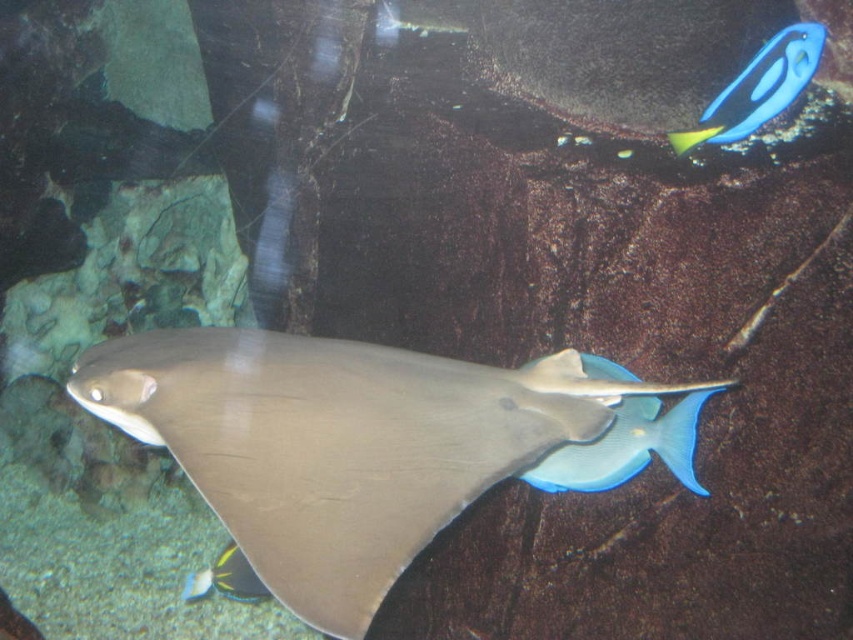
Is smooth gray stingray at center to the left of blue glossy fish at upper right from the viewer's perspective?

Yes, smooth gray stingray at center is to the left of blue glossy fish at upper right.

The width and height of the screenshot is (853, 640). Describe the element at coordinates (340, 444) in the screenshot. I see `smooth gray stingray at center` at that location.

Is point (258, 545) in front of point (743, 81)?

Yes, it is in front of point (743, 81).

The image size is (853, 640). Find the location of `smooth gray stingray at center`. smooth gray stingray at center is located at coordinates (340, 444).

Does smooth gray stingray at center have a larger size compared to shiny blue fish at lower left?

Yes, smooth gray stingray at center is bigger than shiny blue fish at lower left.

Consider the image. Can you confirm if smooth gray stingray at center is taller than shiny blue fish at lower left?

Correct, smooth gray stingray at center is much taller as shiny blue fish at lower left.

Is point (390, 448) less distant than point (196, 582)?

Yes, point (390, 448) is in front of point (196, 582).

This screenshot has width=853, height=640. Find the location of `smooth gray stingray at center`. smooth gray stingray at center is located at coordinates (340, 444).

Does blue glossy fish at center have a smaller size compared to shiny blue fish at lower left?

Correct, blue glossy fish at center occupies less space than shiny blue fish at lower left.

Looking at this image, who is lower down, blue glossy fish at center or shiny blue fish at lower left?

shiny blue fish at lower left is lower down.

Is point (639, 452) less distant than point (216, 570)?

Yes.

This screenshot has height=640, width=853. Find the location of `blue glossy fish at center`. blue glossy fish at center is located at coordinates (628, 445).